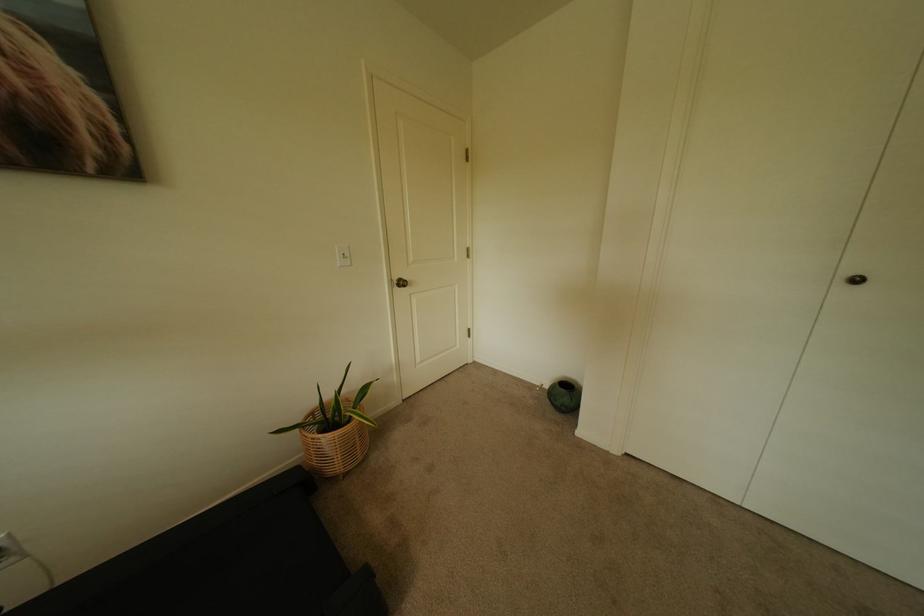
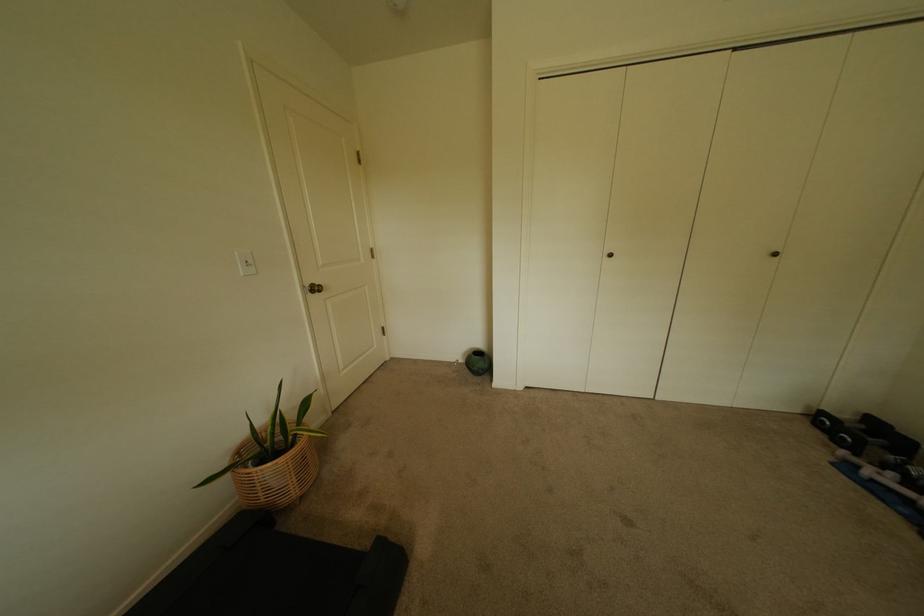
In the second image, find the point that corresponds to [347,458] in the first image.

(302, 480)